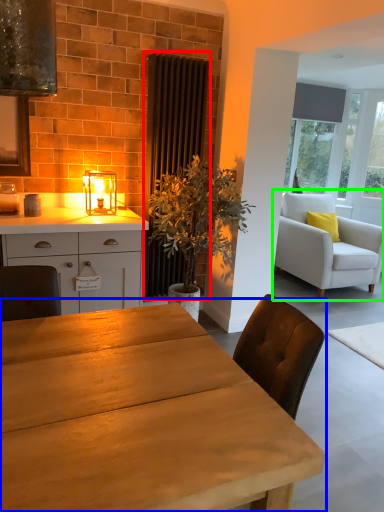
Question: Which object is positioned farthest from curtain (highlighted by a red box)? Select from table (highlighted by a blue box) and chair (highlighted by a green box).

Choices:
 (A) table
 (B) chair

Answer: (A)